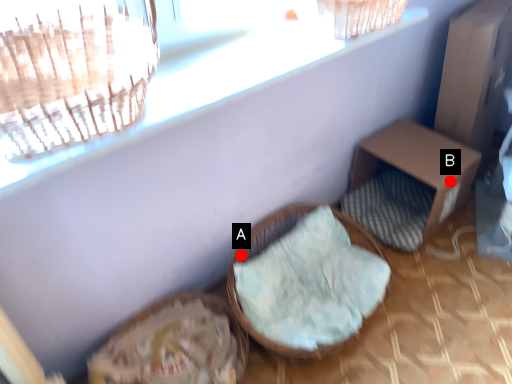
Question: Two points are circled on the image, labeled by A and B beside each circle. Which point is farther from the camera taking this photo?

Choices:
 (A) A is further
 (B) B is further

Answer: (B)